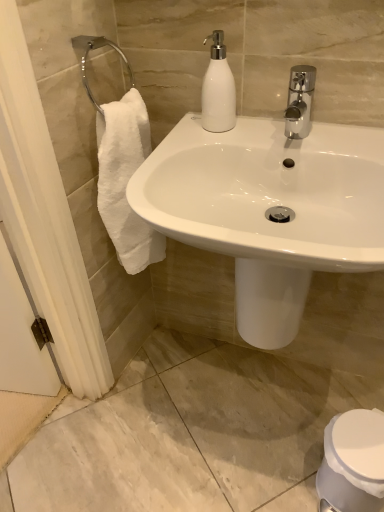
This screenshot has width=384, height=512. In order to click on free space on the front side of white glossy soap dispenser at upper center in this screenshot , I will do 210,144.